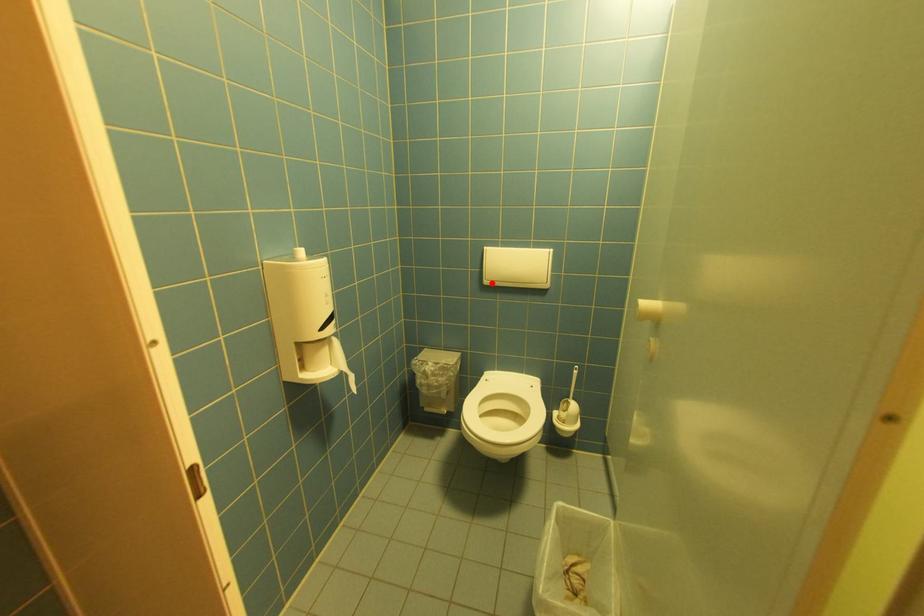
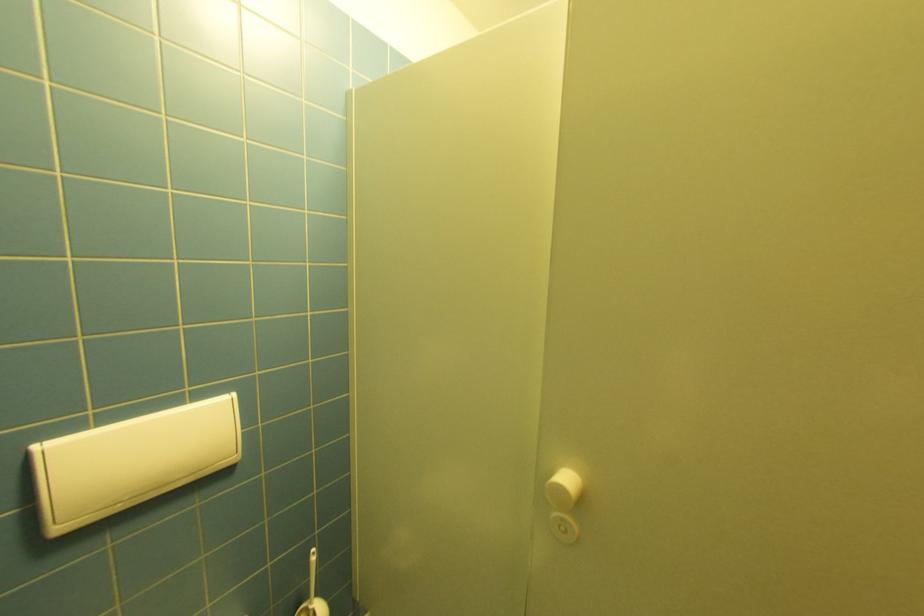
The point at the highlighted location is marked in the first image. Where is the corresponding point in the second image?

(66, 530)